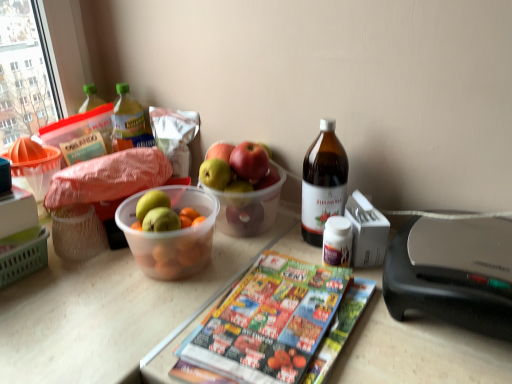
Question: From a real-world perspective, is printed paper magazine at center positioned under translucent plastic bottle at upper left, which ranks as the second bottle in bottom-to-top order, based on gravity?

Choices:
 (A) yes
 (B) no

Answer: (A)

Question: Is translucent plastic bottle at upper left, the 1th bottle in the top-to-bottom sequence, at the back of printed paper magazine at center?

Choices:
 (A) no
 (B) yes

Answer: (A)

Question: Is printed paper magazine at center directly adjacent to translucent plastic bottle at upper left, the second bottle positioned from the right?

Choices:
 (A) no
 (B) yes

Answer: (A)

Question: Is printed paper magazine at center to the left of translucent plastic bottle at upper left, the second bottle positioned from the right, from the viewer's perspective?

Choices:
 (A) yes
 (B) no

Answer: (B)

Question: Would you say printed paper magazine at center contains translucent plastic bottle at upper left, the 1th bottle in the top-to-bottom sequence?

Choices:
 (A) no
 (B) yes

Answer: (A)

Question: Looking at the image, does translucent plastic bottle at upper left, the 1th bottle in the top-to-bottom sequence, seem bigger or smaller compared to printed paper magazine at center?

Choices:
 (A) big
 (B) small

Answer: (B)

Question: Which is correct: translucent plastic bottle at upper left, which ranks as the second bottle in bottom-to-top order, is inside printed paper magazine at center, or outside of it?

Choices:
 (A) inside
 (B) outside

Answer: (B)

Question: Is point (132, 125) closer or farther from the camera than point (245, 345)?

Choices:
 (A) closer
 (B) farther

Answer: (B)

Question: In the image, is translucent plastic bottle at upper left, which ranks as the second bottle in bottom-to-top order, positioned in front of or behind printed paper magazine at center?

Choices:
 (A) front
 (B) behind

Answer: (B)

Question: In terms of height, does brown glass bottle at upper right, which is the 1th bottle in bottom-to-top order, look taller or shorter compared to translucent plastic bottle at upper left, which is the first bottle from left to right?

Choices:
 (A) short
 (B) tall

Answer: (B)

Question: From the image's perspective, is brown glass bottle at upper right, the second bottle viewed from the left, positioned above or below translucent plastic bottle at upper left, the second bottle positioned from the right?

Choices:
 (A) below
 (B) above

Answer: (A)

Question: From a real-world perspective, is brown glass bottle at upper right, the second bottle positioned from the back, positioned above or below translucent plastic bottle at upper left, the second bottle positioned from the right?

Choices:
 (A) below
 (B) above

Answer: (A)

Question: Visually, is brown glass bottle at upper right, which ranks as the 1th bottle in front-to-back order, positioned to the left or to the right of translucent plastic bottle at upper left, which is the first bottle from left to right?

Choices:
 (A) right
 (B) left

Answer: (A)

Question: Is green matte grapefruit at center to the left or to the right of brown glass bottle at upper right, the second bottle viewed from the left, in the image?

Choices:
 (A) left
 (B) right

Answer: (A)

Question: From a real-world perspective, is green matte grapefruit at center positioned above or below brown glass bottle at upper right, the second bottle viewed from the left?

Choices:
 (A) below
 (B) above

Answer: (A)